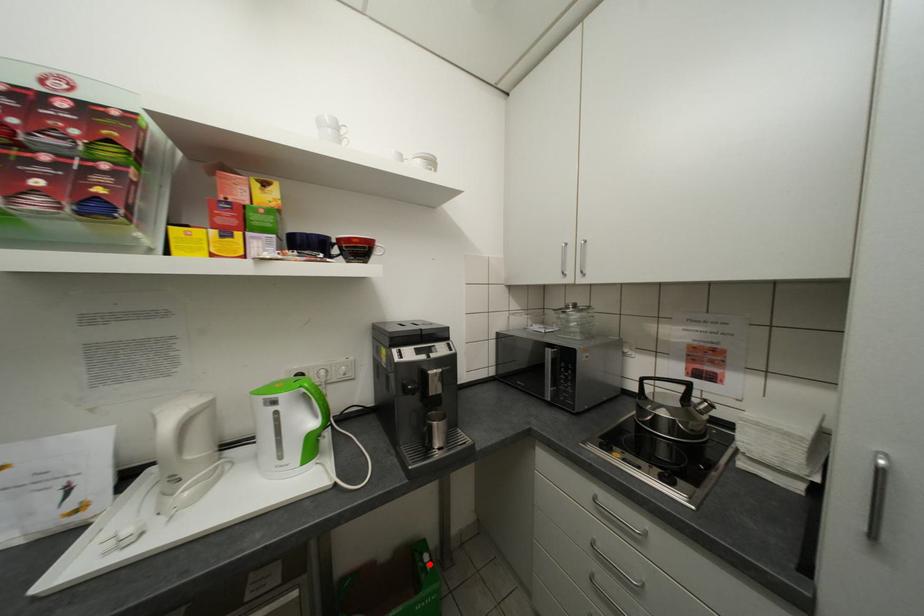
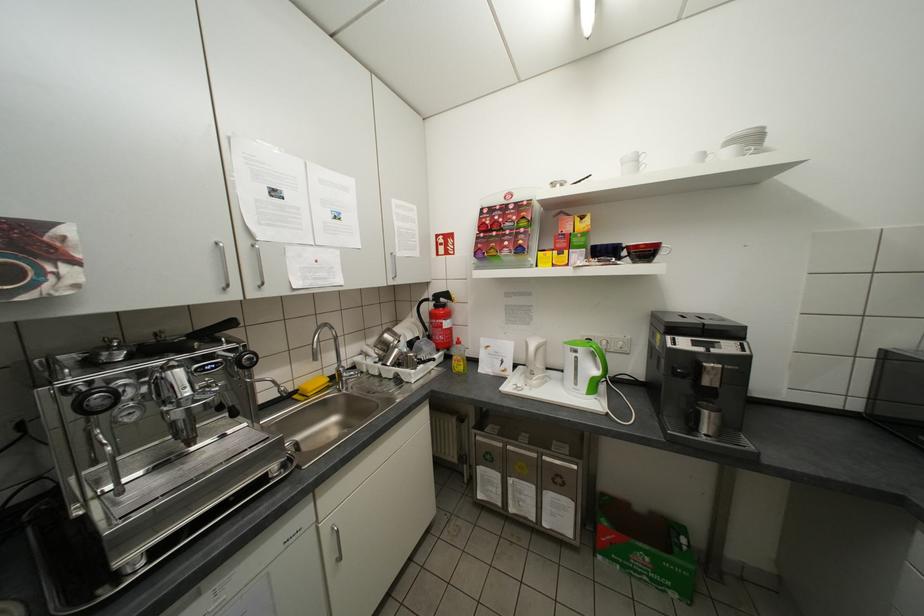
Question: A red point is marked in image1. In image2, is the corresponding 3D point closer to the camera or farther? Reply with the corresponding letter.

Choices:
 (A) The corresponding 3D point is closer.
 (B) The corresponding 3D point is farther.

Answer: (B)